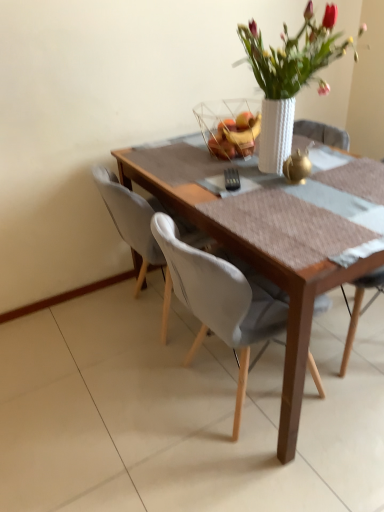
Question: Should I look upward or downward to see wooden table at center?

Choices:
 (A) down
 (B) up

Answer: (B)

Question: Is white fabric chair at center at the back of white textured vase at upper center?

Choices:
 (A) no
 (B) yes

Answer: (A)

Question: From the image's perspective, is white textured vase at upper center above white fabric chair at center?

Choices:
 (A) yes
 (B) no

Answer: (A)

Question: Can you see white textured vase at upper center touching white fabric chair at center?

Choices:
 (A) no
 (B) yes

Answer: (A)

Question: Is white textured vase at upper center not near white fabric chair at center?

Choices:
 (A) yes
 (B) no

Answer: (B)

Question: Considering the relative positions of white textured vase at upper center and white fabric chair at center in the image provided, is white textured vase at upper center to the left of white fabric chair at center from the viewer's perspective?

Choices:
 (A) no
 (B) yes

Answer: (A)

Question: Is the position of white textured vase at upper center more distant than that of white fabric chair at center?

Choices:
 (A) no
 (B) yes

Answer: (A)

Question: Is there a large distance between white fabric chair at center and translucent glass bowl at center?

Choices:
 (A) no
 (B) yes

Answer: (A)

Question: From the image's perspective, is white fabric chair at center on top of translucent glass bowl at center?

Choices:
 (A) yes
 (B) no

Answer: (B)

Question: Is white fabric chair at center wider than translucent glass bowl at center?

Choices:
 (A) no
 (B) yes

Answer: (B)

Question: Is white fabric chair at center not inside translucent glass bowl at center?

Choices:
 (A) no
 (B) yes

Answer: (B)

Question: Considering the relative sizes of white fabric chair at center and translucent glass bowl at center in the image provided, is white fabric chair at center shorter than translucent glass bowl at center?

Choices:
 (A) no
 (B) yes

Answer: (A)

Question: Is white fabric chair at center turned away from translucent glass bowl at center?

Choices:
 (A) no
 (B) yes

Answer: (A)

Question: From a real-world perspective, does white textured vase at upper center sit lower than translucent glass bowl at center?

Choices:
 (A) yes
 (B) no

Answer: (B)